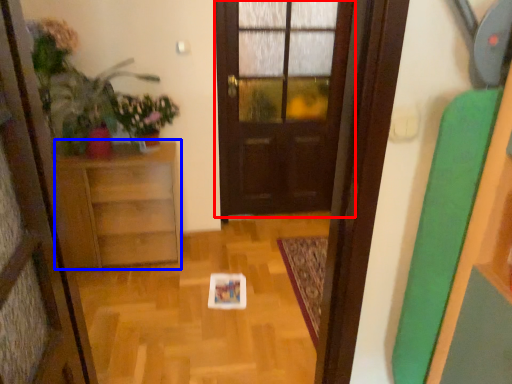
Question: Which object is further to the camera taking this photo, door (highlighted by a red box) or furniture (highlighted by a blue box)?

Choices:
 (A) door
 (B) furniture

Answer: (A)